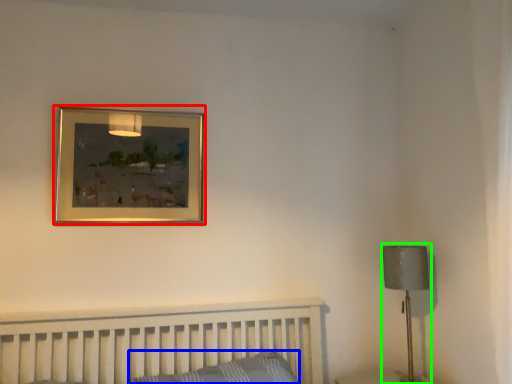
Question: Considering the real-world distances, which object is farthest from picture frame (highlighted by a red box)? pillow (highlighted by a blue box) or table lamp (highlighted by a green box)?

Choices:
 (A) pillow
 (B) table lamp

Answer: (B)